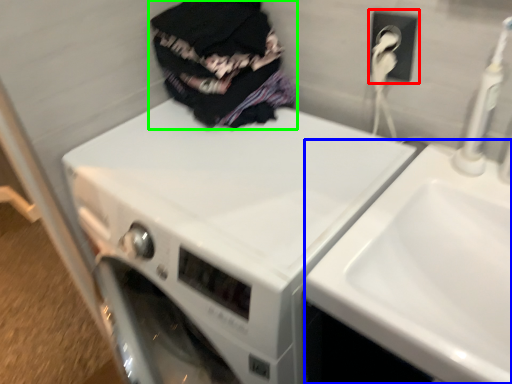
Question: Considering the real-world distances, which object is closest to electric outlet (highlighted by a red box)? sink (highlighted by a blue box) or clothing (highlighted by a green box).

Choices:
 (A) sink
 (B) clothing

Answer: (B)